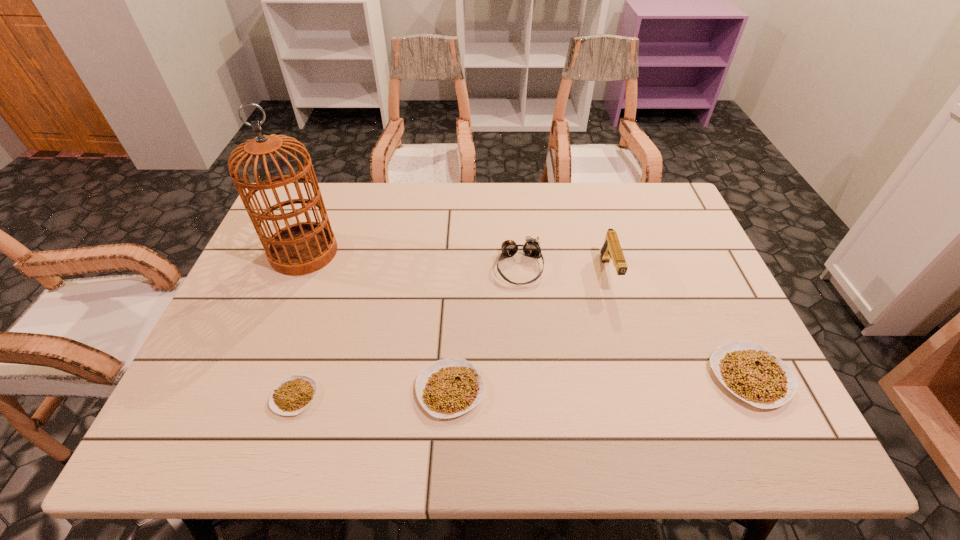
What are the coordinates of `free region that satisfies the following two spatial constraints: 1. at the barrel of the fifth shortest object; 2. on the right side of the rightmost object` in the screenshot? It's located at (638, 376).